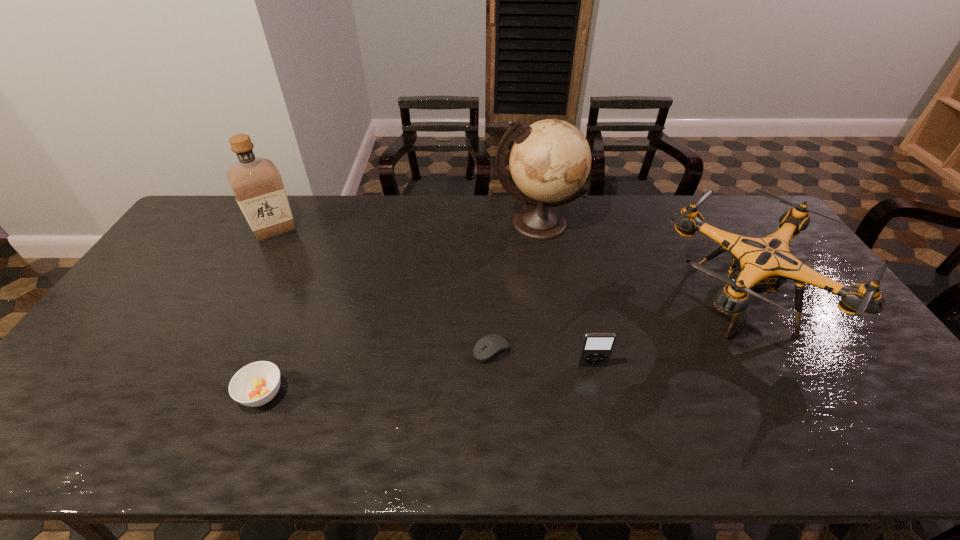
Where is `vacant region at the near edge of the desktop`? The height and width of the screenshot is (540, 960). vacant region at the near edge of the desktop is located at coordinates (433, 424).

Find the location of `vacant space at the right edge`. vacant space at the right edge is located at coordinates (827, 298).

The width and height of the screenshot is (960, 540). What are the coordinates of `free region at the far right corner of the desktop` in the screenshot? It's located at (753, 222).

In the image, there is a desktop. Where is `vacant space at the near right corner`? This screenshot has width=960, height=540. vacant space at the near right corner is located at coordinates (940, 448).

The image size is (960, 540). I want to click on free point between the computer equipment and the drone, so 616,326.

In order to click on empty space that is in between the computer equipment and the leftmost object in this screenshot , I will do `click(383, 291)`.

Locate an element on the screen. The width and height of the screenshot is (960, 540). vacant area between the leftmost object and the globe is located at coordinates (406, 227).

Identify the location of free space that is in between the globe and the drone. Image resolution: width=960 pixels, height=540 pixels. (639, 262).

Locate an element on the screen. blank region between the computer equipment and the rightmost object is located at coordinates (616, 326).

The height and width of the screenshot is (540, 960). I want to click on free spot between the drone and the liquor, so click(x=508, y=265).